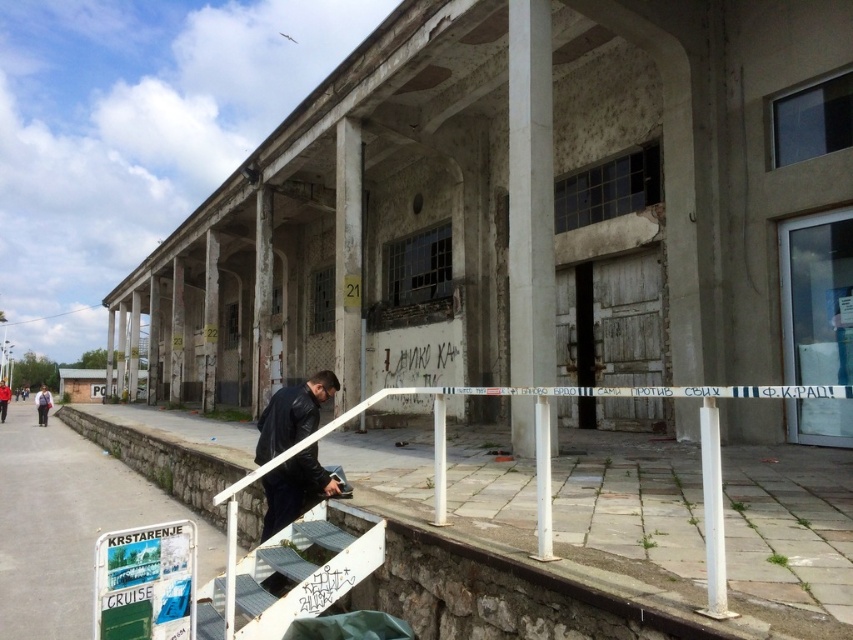
Question: Does white metal railing at lower center appear on the left side of gray concrete pavement at lower left?

Choices:
 (A) no
 (B) yes

Answer: (A)

Question: Does white metal railing at lower center have a larger size compared to metallic/stainless steel stairs at lower center?

Choices:
 (A) yes
 (B) no

Answer: (A)

Question: Which is farther from the dark blue leather jacket at lower left?

Choices:
 (A) white metal railing at lower center
 (B) black leather jacket at lower center
 (C) dark blue leather jacket at lower center

Answer: (C)

Question: Which point is farther to the camera?

Choices:
 (A) (775, 600)
 (B) (18, 429)
 (C) (3, 394)

Answer: (C)

Question: Which object appears farthest from the camera in this image?

Choices:
 (A) gray concrete pavement at lower left
 (B) dark blue leather jacket at lower left

Answer: (B)

Question: Can you confirm if gray concrete pavement at lower left is smaller than dark blue leather jacket at lower center?

Choices:
 (A) no
 (B) yes

Answer: (A)